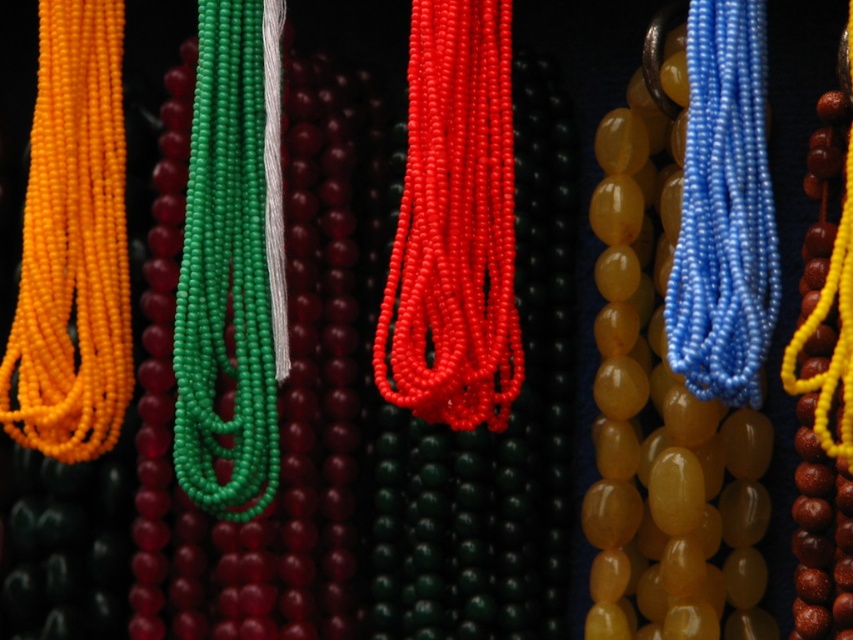
Question: Among these points, which one is nearest to the camera?

Choices:
 (A) (173, 356)
 (B) (752, 284)
 (C) (62, 420)

Answer: (B)

Question: Considering the relative positions of shiny red beads at center and green matte beads at center in the image provided, where is shiny red beads at center located with respect to green matte beads at center?

Choices:
 (A) left
 (B) right

Answer: (B)

Question: Which point is farther from the camera taking this photo?

Choices:
 (A) (259, 259)
 (B) (431, 372)
 (C) (744, 296)
 (D) (67, 401)

Answer: (D)

Question: Does matte yellow rope at left appear over green matte beads at center?

Choices:
 (A) no
 (B) yes

Answer: (B)

Question: Is green matte beads at center further to the viewer compared to blue glossy beads at right?

Choices:
 (A) yes
 (B) no

Answer: (A)

Question: Which point is farther to the camera?

Choices:
 (A) matte yellow rope at left
 (B) shiny red beads at center

Answer: (A)